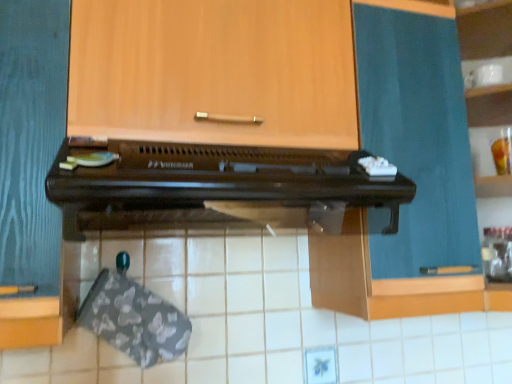
Question: Relative to brown wooden oven at center, is teal fabric curtain at upper right, the 2th cabinetry positioned from the left, in front or behind?

Choices:
 (A) front
 (B) behind

Answer: (B)

Question: Is point (396, 79) closer or farther from the camera than point (294, 193)?

Choices:
 (A) closer
 (B) farther

Answer: (B)

Question: Estimate the real-world distances between objects in this image. Which object is farther from the white glossy cup at upper right?

Choices:
 (A) teal fabric curtain at upper right, placed as the 1th cabinetry when sorted from right to left
 (B) wooden cabinet at upper center, the 2th cabinetry positioned from the right
 (C) brown wooden oven at center

Answer: (C)

Question: Which object is positioned closest to the teal fabric curtain at upper right, the 2th cabinetry positioned from the left?

Choices:
 (A) wooden cabinet at upper center, the 2th cabinetry positioned from the right
 (B) brown wooden oven at center
 (C) white glossy cup at upper right

Answer: (B)